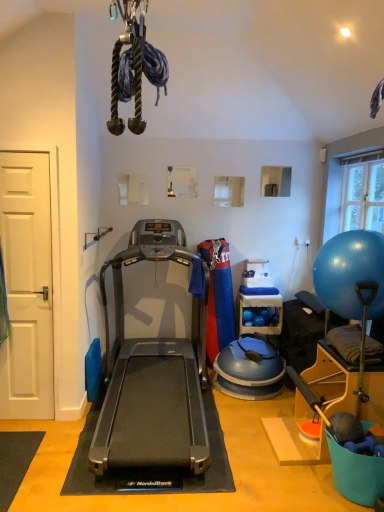
In order to click on blue rubber ball at right in this screenshot , I will do `click(350, 272)`.

In order to face wooden shelf at center, should I rotate leftwards or rightwards?

Rotate right and turn 9.051 degrees.

The image size is (384, 512). I want to click on transparent glass window at upper right, so click(363, 196).

This screenshot has width=384, height=512. Describe the element at coordinates (153, 373) in the screenshot. I see `silver metallic treadmill at center` at that location.

You are a GUI agent. You are given a task and a screenshot of the screen. Output one action in this format:
    pyautogui.click(x=<x>, y=<y>)
    Task: Click on the white matte door at left
    This screenshot has width=384, height=512.
    Given the screenshot: What is the action you would take?
    pyautogui.click(x=27, y=286)

Image resolution: width=384 pixels, height=512 pixels. Describe the element at coordinates (27, 286) in the screenshot. I see `white matte door at left` at that location.

Where is `blue rubber ball at right`? Image resolution: width=384 pixels, height=512 pixels. blue rubber ball at right is located at coordinates (350, 272).

From the image's perspective, which one is positioned lower, silver metallic treadmill at center or transparent glass window at upper right?

From the image's view, silver metallic treadmill at center is below.

Is silver metallic treadmill at center positioned before transparent glass window at upper right?

Yes, silver metallic treadmill at center is closer to the viewer.

Is silver metallic treadmill at center placed right next to transparent glass window at upper right?

They are not placed beside each other.

Does blue rubber ball at right have a greater width compared to transparent glass window at upper right?

Indeed, blue rubber ball at right has a greater width compared to transparent glass window at upper right.

How far apart are blue rubber ball at right and transparent glass window at upper right?

The distance of blue rubber ball at right from transparent glass window at upper right is 4.36 feet.

Locate an element on the screen. The image size is (384, 512). ball in front of the transparent glass window at upper right is located at coordinates (350, 272).

Is blue rubber ball at right completely or partially outside of transparent glass window at upper right?

Yes, blue rubber ball at right is located beyond the bounds of transparent glass window at upper right.

Is silver metallic treadmill at center aimed at wooden shelf at center?

No, silver metallic treadmill at center is not turned towards wooden shelf at center.

Considering the points (130, 394) and (278, 324), which point is in front, point (130, 394) or point (278, 324)?

Point (130, 394)

Where is `shelf on the right of silver metallic treadmill at center`? The width and height of the screenshot is (384, 512). shelf on the right of silver metallic treadmill at center is located at coordinates (260, 306).

From the picture: Considering the relative sizes of silver metallic treadmill at center and wooden shelf at center in the image provided, is silver metallic treadmill at center thinner than wooden shelf at center?

No, silver metallic treadmill at center is not thinner than wooden shelf at center.

From a real-world perspective, relative to blue rubber ball at right, is transparent glass window at upper right vertically above or below?

Clearly, from a real-world perspective, transparent glass window at upper right is above blue rubber ball at right.

Between transparent glass window at upper right and blue rubber ball at right, which one appears on the right side from the viewer's perspective?

From the viewer's perspective, transparent glass window at upper right appears more on the right side.

In terms of width, does transparent glass window at upper right look wider or thinner when compared to blue rubber ball at right?

transparent glass window at upper right is thinner than blue rubber ball at right.

Between point (343, 220) and point (338, 234), which one is positioned in front?

Positioned in front is point (338, 234).

From a real-world perspective, is silver metallic treadmill at center on blue rubber ball at right?

Actually, silver metallic treadmill at center is physically below blue rubber ball at right in the real world.

Where is `ball positioned vertically above the silver metallic treadmill at center (from a real-world perspective)`? This screenshot has height=512, width=384. ball positioned vertically above the silver metallic treadmill at center (from a real-world perspective) is located at coordinates (350, 272).

Does point (104, 451) lie behind point (329, 267)?

That is False.

Which is more to the left, transparent glass window at upper right or silver metallic treadmill at center?

silver metallic treadmill at center.

Is transparent glass window at upper right wider than silver metallic treadmill at center?

In fact, transparent glass window at upper right might be narrower than silver metallic treadmill at center.

Is silver metallic treadmill at center at the back of transparent glass window at upper right?

No, transparent glass window at upper right is not facing the opposite direction of silver metallic treadmill at center.

Is transparent glass window at upper right placed right next to silver metallic treadmill at center?

No, transparent glass window at upper right is not touching silver metallic treadmill at center.

Is transparent glass window at upper right positioned behind wooden shelf at center?

No, the depth of transparent glass window at upper right is less than that of wooden shelf at center.

Is transparent glass window at upper right oriented away from wooden shelf at center?

No, transparent glass window at upper right's orientation is not away from wooden shelf at center.

In terms of height, does transparent glass window at upper right look taller or shorter compared to wooden shelf at center?

transparent glass window at upper right is taller than wooden shelf at center.

Could wooden shelf at center be considered to be inside transparent glass window at upper right?

No, wooden shelf at center is located outside of transparent glass window at upper right.

Where is `treadmill that is under the transparent glass window at upper right (from a real-world perspective)`? This screenshot has width=384, height=512. treadmill that is under the transparent glass window at upper right (from a real-world perspective) is located at coordinates (153, 373).

In order to click on window screen lying on the right of blue rubber ball at right in this screenshot , I will do `click(363, 196)`.

Based on the photo, estimate the real-world distances between objects in this image. Which object is closer to transparent glass window at upper right, wooden shelf at center or silver metallic treadmill at center?

wooden shelf at center.

Which object lies further to the anchor point white matte door at left, silver metallic treadmill at center or transparent glass window at upper right?

transparent glass window at upper right.

Considering their positions, is silver metallic treadmill at center positioned further to transparent glass window at upper right than white matte door at left?

The object further to transparent glass window at upper right is white matte door at left.

From the image, which object appears to be farther from white matte door at left, wooden shelf at center or transparent glass window at upper right?

Among the two, transparent glass window at upper right is located further to white matte door at left.

From the image, which object appears to be nearer to white matte door at left, blue rubber ball at right or wooden shelf at center?

wooden shelf at center is positioned closer to the anchor white matte door at left.

Consider the image. From the image, which object appears to be farther from blue rubber ball at right, silver metallic treadmill at center or transparent glass window at upper right?

silver metallic treadmill at center is further to blue rubber ball at right.

Estimate the real-world distances between objects in this image. Which object is closer to white matte door at left, blue rubber ball at right or silver metallic treadmill at center?

silver metallic treadmill at center is positioned closer to the anchor white matte door at left.

Considering their positions, is white matte door at left positioned closer to transparent glass window at upper right than silver metallic treadmill at center?

silver metallic treadmill at center lies closer to transparent glass window at upper right than the other object.

At what (x,y) coordinates should I click in order to perform the action: click on window screen between blue rubber ball at right and wooden shelf at center along the z-axis. Please return your answer as a coordinate pair (x, y). This screenshot has height=512, width=384. Looking at the image, I should click on (363, 196).

This screenshot has height=512, width=384. Identify the location of shelf between white matte door at left and blue rubber ball at right. (260, 306).

Identify the location of treadmill between white matte door at left and transparent glass window at upper right in the horizontal direction. The height and width of the screenshot is (512, 384). (153, 373).

Where is `ball between white matte door at left and transparent glass window at upper right`? This screenshot has height=512, width=384. ball between white matte door at left and transparent glass window at upper right is located at coordinates (350, 272).